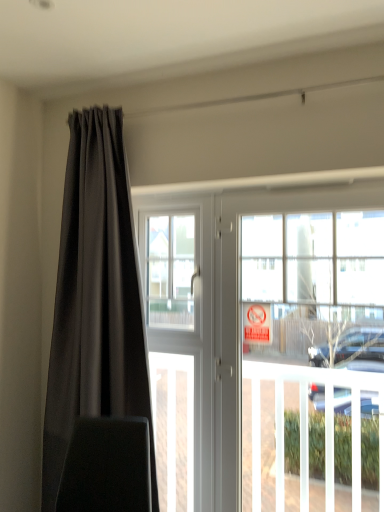
Question: Considering the relative positions of transparent glass window screen at center and white glossy door at center in the image provided, is transparent glass window screen at center to the right of white glossy door at center from the viewer's perspective?

Choices:
 (A) yes
 (B) no

Answer: (B)

Question: Is transparent glass window screen at center at the left side of white glossy door at center?

Choices:
 (A) no
 (B) yes

Answer: (B)

Question: Would you say white glossy door at center is part of transparent glass window screen at center's contents?

Choices:
 (A) yes
 (B) no

Answer: (B)

Question: Is the position of transparent glass window screen at center more distant than that of white glossy door at center?

Choices:
 (A) no
 (B) yes

Answer: (B)

Question: From a real-world perspective, is transparent glass window screen at center over white glossy door at center?

Choices:
 (A) no
 (B) yes

Answer: (B)

Question: Is transparent glass window screen at center smaller than white glossy door at center?

Choices:
 (A) yes
 (B) no

Answer: (A)

Question: Is white glossy door at center looking in the opposite direction of red plastic sign at window?

Choices:
 (A) no
 (B) yes

Answer: (B)

Question: Does white glossy door at center have a greater height compared to red plastic sign at window?

Choices:
 (A) yes
 (B) no

Answer: (A)

Question: Is white glossy door at center facing towards red plastic sign at window?

Choices:
 (A) no
 (B) yes

Answer: (B)

Question: Is white glossy door at center positioned far away from red plastic sign at window?

Choices:
 (A) yes
 (B) no

Answer: (B)

Question: Can you confirm if white glossy door at center is shorter than red plastic sign at window?

Choices:
 (A) no
 (B) yes

Answer: (A)

Question: From the image's perspective, is white glossy door at center on top of red plastic sign at window?

Choices:
 (A) no
 (B) yes

Answer: (A)

Question: Can you confirm if red plastic sign at window is positioned to the left of transparent glass window screen at center?

Choices:
 (A) yes
 (B) no

Answer: (B)